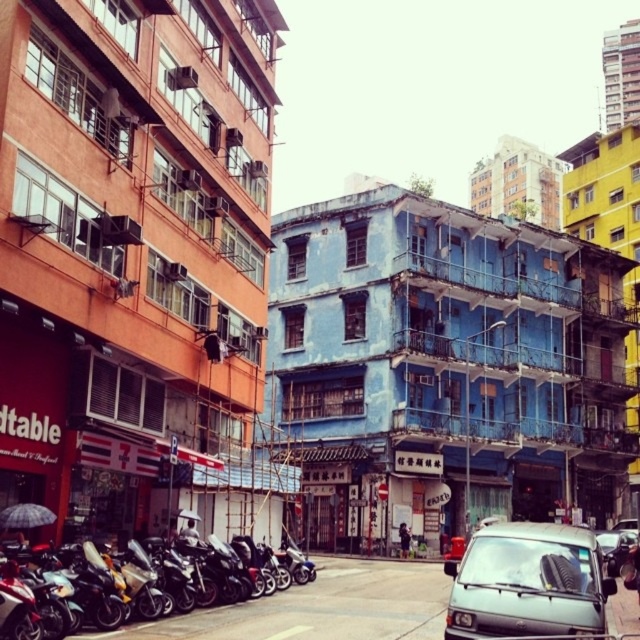
Question: Among these points, which one is farthest from the camera?

Choices:
 (A) (561, 580)
 (B) (604, 531)

Answer: (B)

Question: Which point appears closest to the camera in this image?

Choices:
 (A) (628, 547)
 (B) (602, 586)

Answer: (B)

Question: Which of the following is the closest to the observer?

Choices:
 (A) silver metallic van at lower right
 (B) metallic silver van at lower right

Answer: (A)

Question: Does silver metallic van at lower right appear on the right side of metallic silver van at lower right?

Choices:
 (A) no
 (B) yes

Answer: (A)

Question: Is silver metallic van at lower right closer to the viewer compared to metallic silver van at lower right?

Choices:
 (A) no
 (B) yes

Answer: (B)

Question: Is silver metallic van at lower right positioned at the back of metallic silver van at lower right?

Choices:
 (A) no
 (B) yes

Answer: (A)